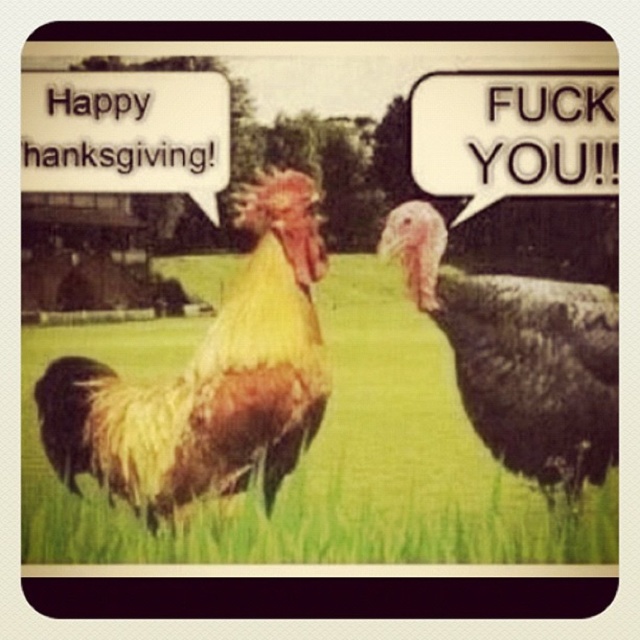
You are a photographer taking a picture of the two points in the image. Which point, point (307, 236) or point (595, 484), is closer to your camera?

Point (307, 236) is closer to the camera than point (595, 484).